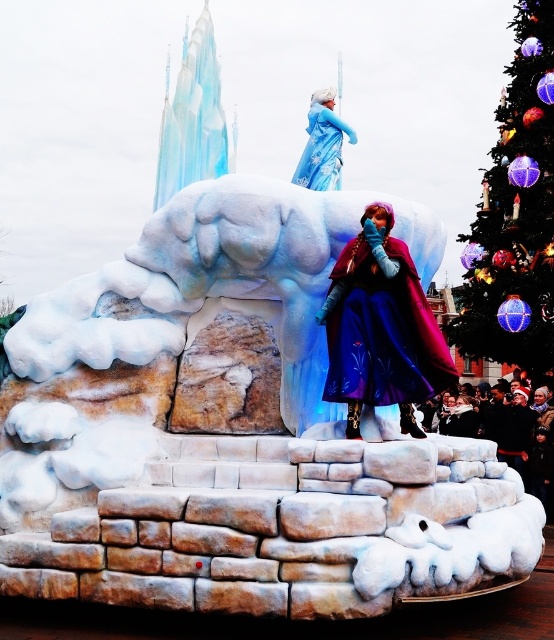
You are an event planner looking at the float design for the Frozen parade. You notice the iridescent glass ornaments at upper right and the matte blue dress at center. Which object is located to the right of the other?

The iridescent glass ornaments at upper right is positioned on the right side of matte blue dress at center.

You are a photographer at the event and want to capture both the iridescent glass ornaments at upper right and the purple satin dress at center in a single photo. Which object should you focus on first to ensure both are in frame?

Since the iridescent glass ornaments at upper right are larger than the purple satin dress at center, you should focus on the iridescent glass ornaments at upper right first to ensure both fit within the frame.